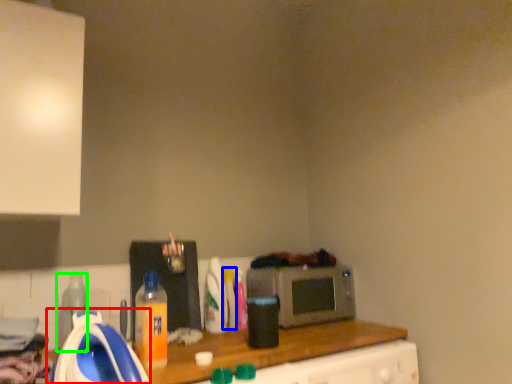
Question: Which object is the closest to the appliance (highlighted by a red box)? Choose among these: bottle (highlighted by a blue box) or bottle (highlighted by a green box).

Choices:
 (A) bottle
 (B) bottle

Answer: (B)